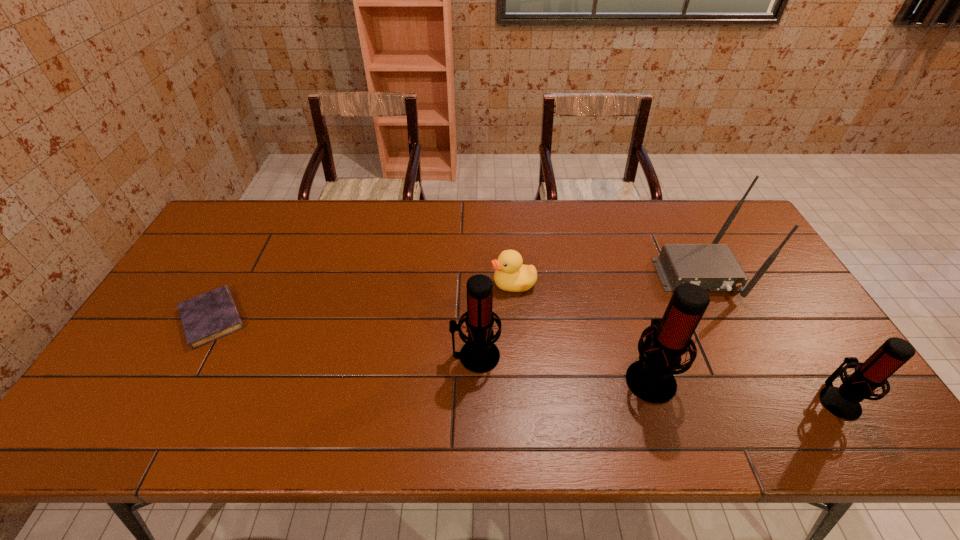
The height and width of the screenshot is (540, 960). Identify the location of the second tallest microphone. (479, 355).

The width and height of the screenshot is (960, 540). Find the location of `the fourth object from left to right`. the fourth object from left to right is located at coordinates click(651, 378).

Find the location of `the rightmost object`. the rightmost object is located at coordinates (843, 402).

The width and height of the screenshot is (960, 540). I want to click on the third shortest object, so click(843, 402).

Locate an element on the screen. This screenshot has width=960, height=540. the second object from right to left is located at coordinates (713, 266).

Locate an element on the screen. The image size is (960, 540). the second shortest object is located at coordinates (511, 275).

This screenshot has height=540, width=960. Find the location of `the shortest object`. the shortest object is located at coordinates (212, 315).

This screenshot has width=960, height=540. In order to click on diary in this screenshot , I will do `click(212, 315)`.

At what (x,y) coordinates should I click in order to perform the action: click on vacant space located on the left of the leftmost microphone. Please return your answer as a coordinate pair (x, y). Looking at the image, I should click on (423, 356).

In order to click on free point located 0.050m on the back of the second microphone from right to left in this screenshot , I will do `click(636, 337)`.